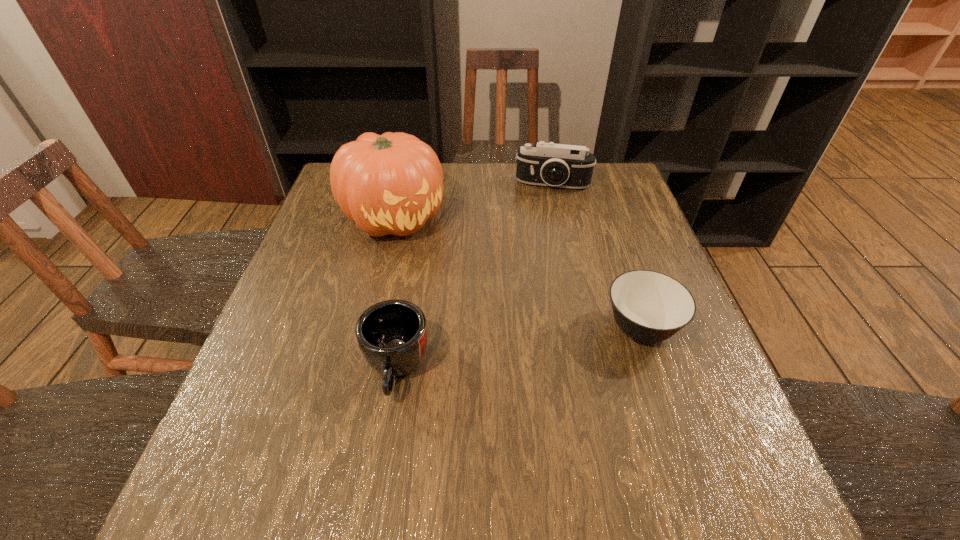
In the image, there is a desktop. What are the coordinates of `vacant region at the far edge` in the screenshot? It's located at (470, 183).

Locate an element on the screen. The height and width of the screenshot is (540, 960). vacant space at the near edge of the desktop is located at coordinates (457, 434).

The height and width of the screenshot is (540, 960). I want to click on vacant space at the left edge of the desktop, so click(x=309, y=252).

Locate an element on the screen. The height and width of the screenshot is (540, 960). free space at the right edge of the desktop is located at coordinates (667, 340).

In the image, there is a desktop. In order to click on free space at the near left corner in this screenshot , I will do `click(271, 438)`.

The width and height of the screenshot is (960, 540). In the image, there is a desktop. Identify the location of free space at the far right corner. (618, 192).

Identify the location of free space at the near right corner of the desktop. This screenshot has width=960, height=540. (726, 411).

This screenshot has width=960, height=540. Identify the location of empty location between the shortest object and the tallest object. click(517, 273).

You are a GUI agent. You are given a task and a screenshot of the screen. Output one action in this format:
    pyautogui.click(x=<x>, y=<y>)
    Task: Click on the free space between the third shortest object and the pumpkin
    
    Given the screenshot: What is the action you would take?
    pyautogui.click(x=473, y=201)

The width and height of the screenshot is (960, 540). I want to click on free spot between the mug and the camera, so click(474, 276).